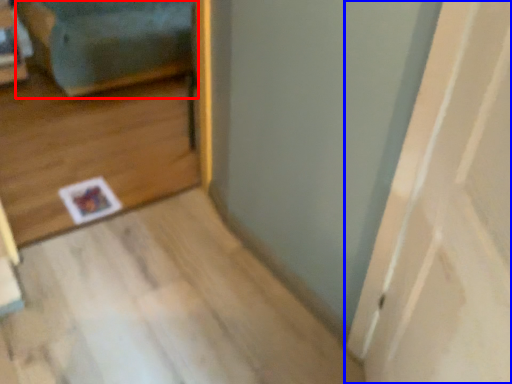
Question: Which object is closer to the camera taking this photo, couch (highlighted by a red box) or door (highlighted by a blue box)?

Choices:
 (A) couch
 (B) door

Answer: (B)